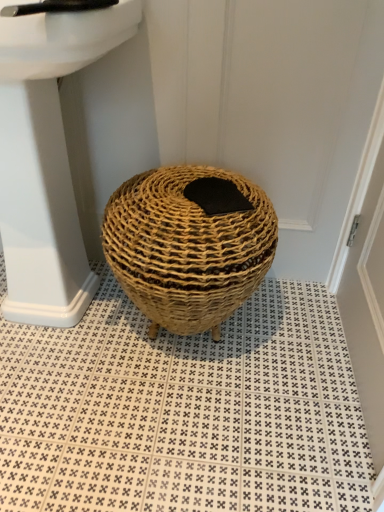
Find the location of a particular element. This screenshot has width=384, height=512. vacant space that is to the left of black felt pad at center is located at coordinates (148, 201).